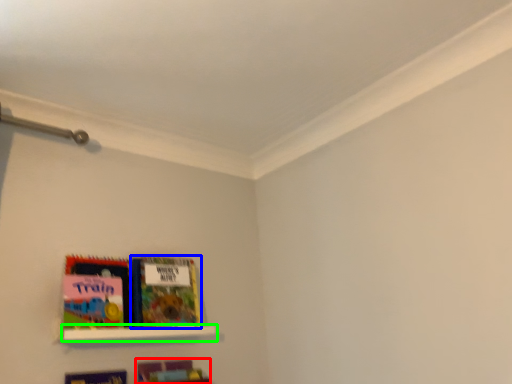
Question: Estimate the real-world distances between objects in this image. Which object is farther from book (highlighted by a red box), book (highlighted by a blue box) or shelf (highlighted by a green box)?

Choices:
 (A) book
 (B) shelf

Answer: (A)